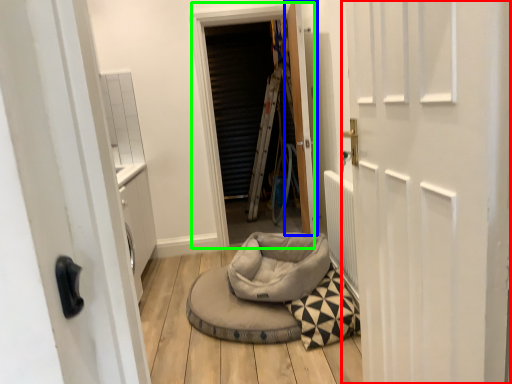
Question: Which object is the closest to the door (highlighted by a red box)? Choose among these: door (highlighted by a blue box) or window screen (highlighted by a green box).

Choices:
 (A) door
 (B) window screen

Answer: (A)